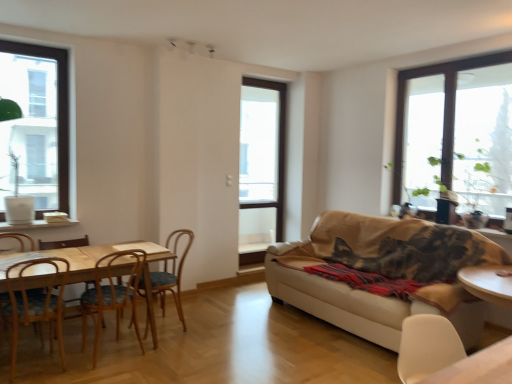
The image size is (512, 384). What are the coordinates of `free point above transparent glass window at upper right, which ranks as the 3th window in left-to-right order (from a real-world perspective)` in the screenshot? It's located at (455, 56).